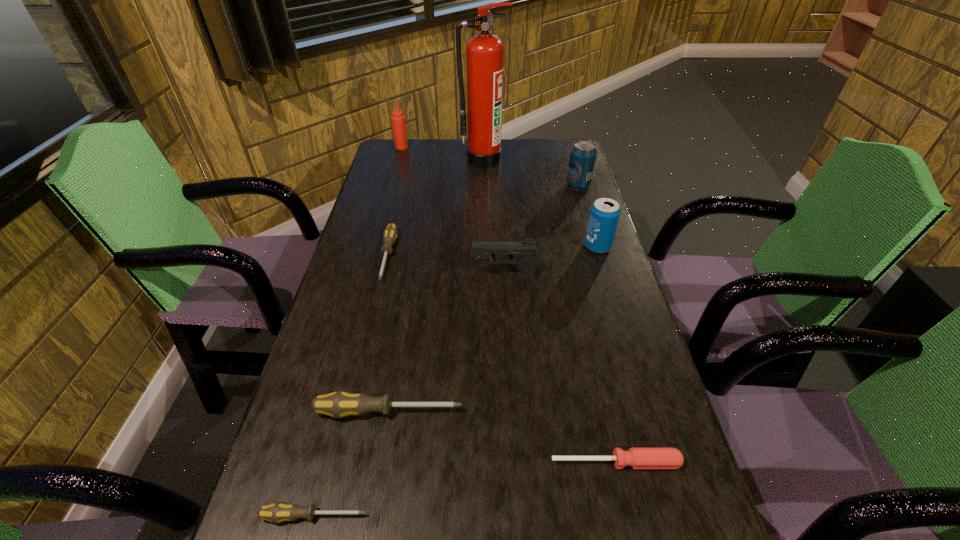
Select which gray screwdriver appears as the closest to the farthest object. Please provide its 2D coordinates. Your answer should be formatted as a tuple, i.e. [(x, y)], where the tuple contains the x and y coordinates of a point satisfying the conditions above.

[(390, 233)]

The height and width of the screenshot is (540, 960). I want to click on blank area in the image that satisfies the following two spatial constraints: 1. at the tip of the eighth farthest object; 2. on the right side of the sixth tallest object, so click(x=380, y=462).

The height and width of the screenshot is (540, 960). In order to click on blank area in the image that satisfies the following two spatial constraints: 1. at the tip of the farthest screwdriver; 2. on the left side of the rightmost screwdriver in this screenshot , I will do `click(339, 462)`.